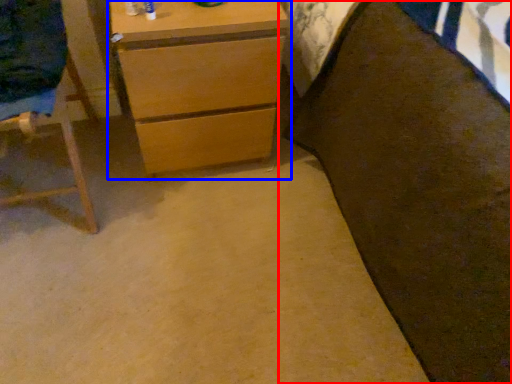
Question: Which object appears closest to the camera in this image, bed (highlighted by a red box) or chest of drawers (highlighted by a blue box)?

Choices:
 (A) bed
 (B) chest of drawers

Answer: (A)